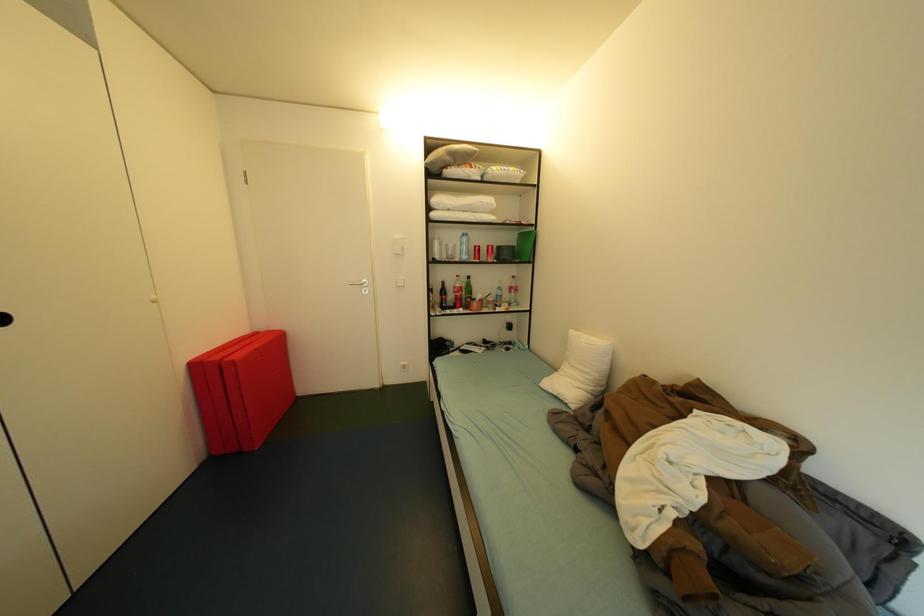
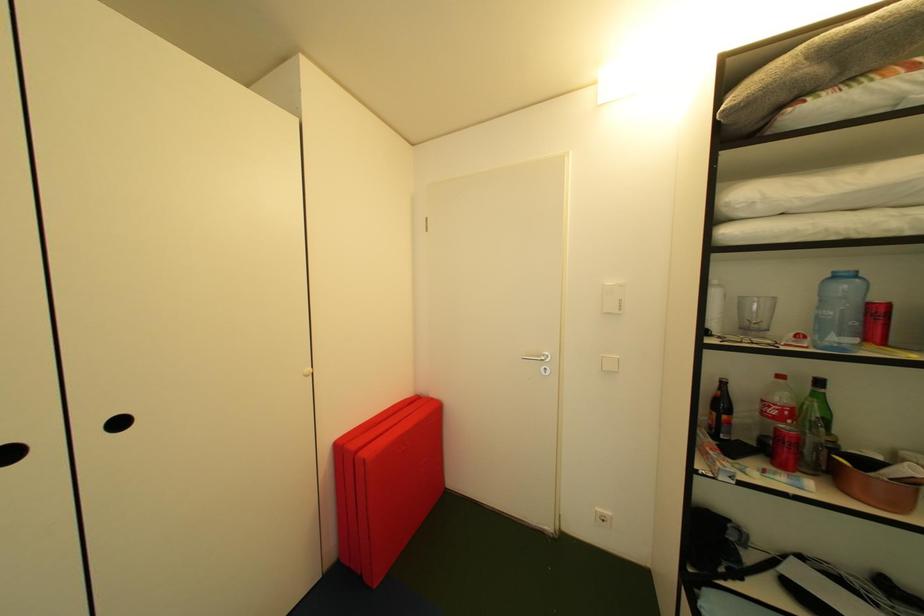
Question: The first image is from the beginning of the video and the second image is from the end. How did the camera likely rotate when shooting the video?

Choices:
 (A) Left
 (B) Right
 (C) Up
 (D) Down

Answer: (A)